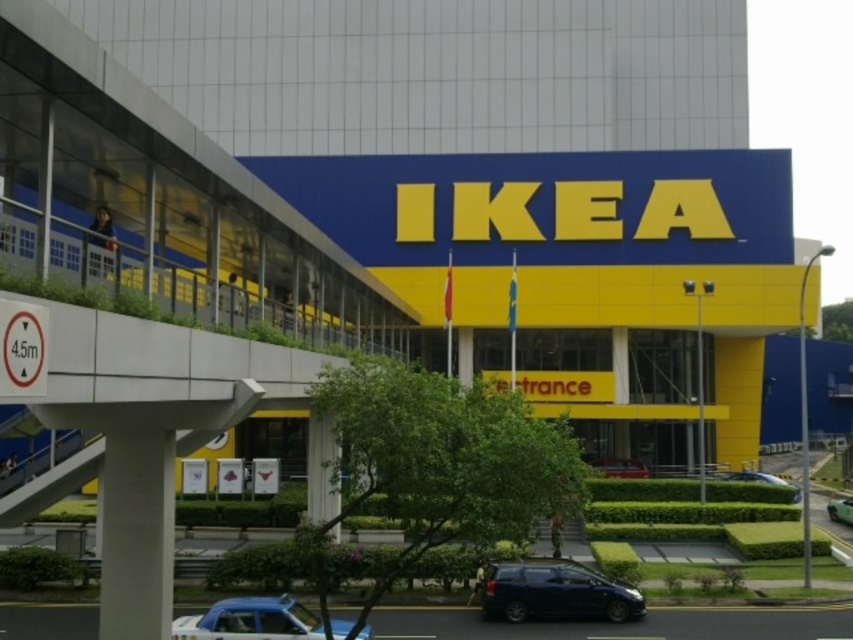
Question: Which point is farther from the camera taking this photo?

Choices:
 (A) (782, 481)
 (B) (643, 468)

Answer: (A)

Question: Which object is the closest to the green matte car at lower right?

Choices:
 (A) metallic silver car at center
 (B) metallic blue sedan at center

Answer: (A)

Question: Among these objects, which one is nearest to the camera?

Choices:
 (A) metallic blue sedan at center
 (B) shiny dark blue minivan at lower center
 (C) green matte car at lower right
 (D) metallic silver car at center

Answer: (B)

Question: Is shiny dark blue minivan at lower center smaller than blue metallic car at lower left?

Choices:
 (A) yes
 (B) no

Answer: (B)

Question: Considering the relative positions of blue metallic car at lower left and green matte car at lower right in the image provided, where is blue metallic car at lower left located with respect to green matte car at lower right?

Choices:
 (A) left
 (B) right

Answer: (A)

Question: Can you confirm if shiny dark blue minivan at lower center is positioned to the left of metallic silver car at center?

Choices:
 (A) yes
 (B) no

Answer: (A)